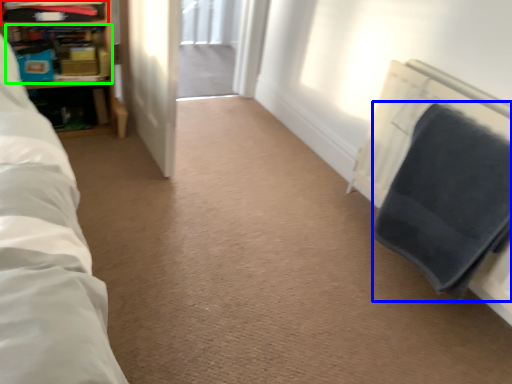
Question: Which object is the closest to the shelf (highlighted by a red box)? Choose among these: blanket (highlighted by a blue box) or shelf (highlighted by a green box).

Choices:
 (A) blanket
 (B) shelf

Answer: (B)